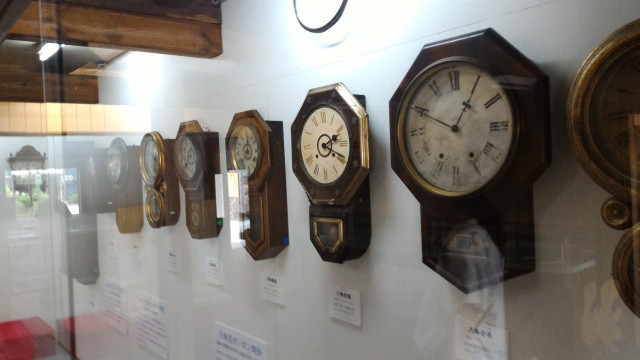
Image resolution: width=640 pixels, height=360 pixels. I want to click on wall sign, so click(x=109, y=304), click(x=156, y=328), click(x=237, y=349).